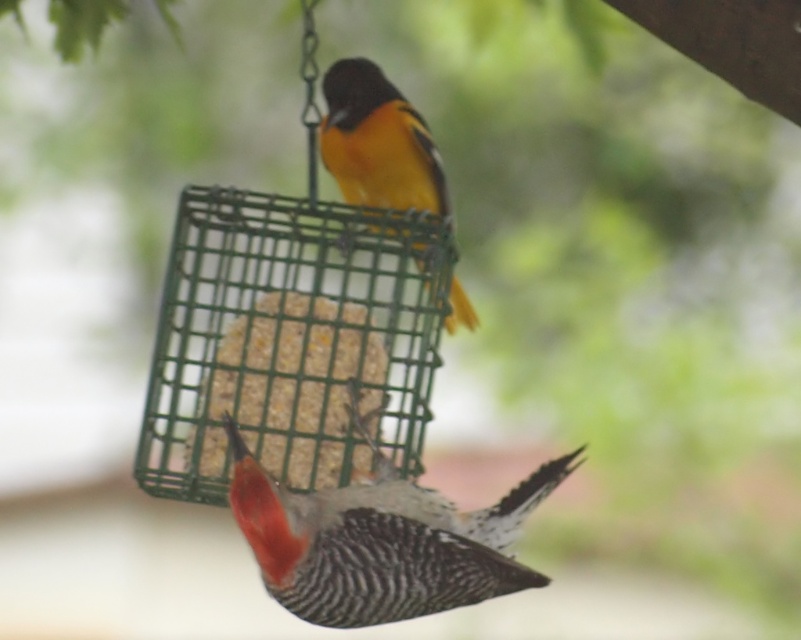
Can you confirm if speckled gray woodpecker at lower center is positioned below speckled gray woodpecker at center?

Indeed, speckled gray woodpecker at lower center is positioned under speckled gray woodpecker at center.

Can you confirm if speckled gray woodpecker at lower center is smaller than speckled gray woodpecker at center?

No.

Image resolution: width=801 pixels, height=640 pixels. Describe the element at coordinates (380, 540) in the screenshot. I see `speckled gray woodpecker at lower center` at that location.

The width and height of the screenshot is (801, 640). Find the location of `speckled gray woodpecker at lower center`. speckled gray woodpecker at lower center is located at coordinates [380, 540].